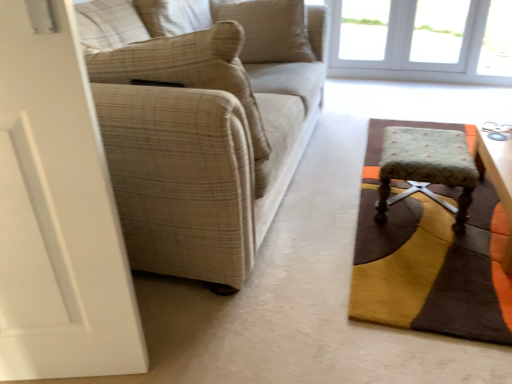
Where is `free space above floral fabric stool at lower right (from a real-world perspective)`? Image resolution: width=512 pixels, height=384 pixels. free space above floral fabric stool at lower right (from a real-world perspective) is located at coordinates (419, 141).